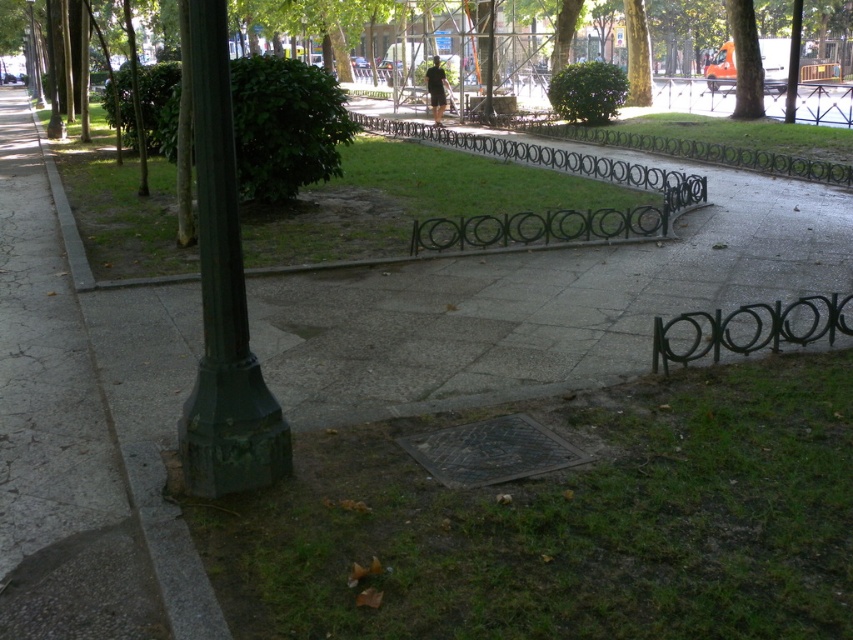
Question: Can you confirm if green grass at center is positioned to the right of green leafy tree at upper right?

Choices:
 (A) yes
 (B) no

Answer: (B)

Question: Can you confirm if green grass at center is bigger than green leafy tree at upper right?

Choices:
 (A) yes
 (B) no

Answer: (A)

Question: Can you confirm if green grass at lower center is positioned above green leafy tree at upper right?

Choices:
 (A) no
 (B) yes

Answer: (A)

Question: Among these points, which one is farthest from the camera?

Choices:
 (A) (222, 397)
 (B) (178, 259)

Answer: (B)

Question: Which is nearer to the green grass at center?

Choices:
 (A) green leafy tree at upper right
 (B) green grass at lower center

Answer: (B)

Question: Estimate the real-world distances between objects in this image. Which object is closer to the green leafy tree at upper right?

Choices:
 (A) green grass at center
 (B) green matte pole at left
 (C) green grass at lower center

Answer: (A)